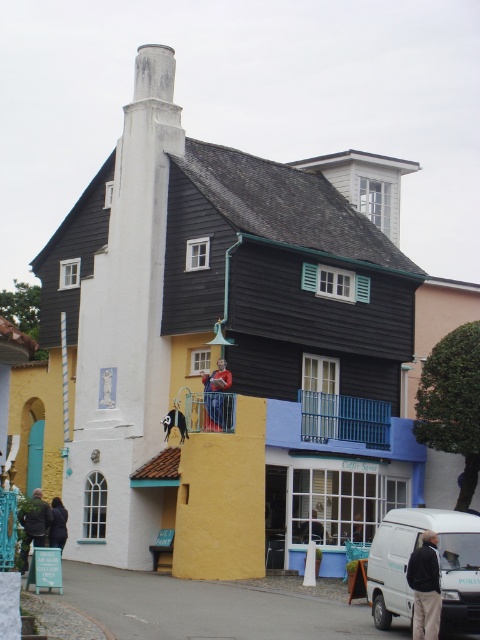
Between blue painted wood balcony at center and dark blue fabric at center, which one is positioned higher?

Positioned higher is blue painted wood balcony at center.

The image size is (480, 640). What do you see at coordinates (210, 412) in the screenshot? I see `blue painted wood balcony at center` at bounding box center [210, 412].

Between point (189, 403) and point (308, 524), which one is positioned behind?

The point (308, 524) is more distant.

At what (x,y) coordinates should I click in order to perform the action: click on blue painted wood balcony at center. Please return your answer as a coordinate pair (x, y). The height and width of the screenshot is (640, 480). Looking at the image, I should click on (210, 412).

Is black leather jacket at lower right below denim pants at center?

Indeed, black leather jacket at lower right is positioned under denim pants at center.

Who is higher up, black leather jacket at lower right or denim pants at center?

Positioned higher is denim pants at center.

Find the location of a particular element. black leather jacket at lower right is located at coordinates (425, 588).

Does denim pants at center come in front of dark green jacket at lower left?

That is False.

Is denim pants at center shorter than dark green jacket at lower left?

No.

The image size is (480, 640). Describe the element at coordinates (216, 396) in the screenshot. I see `denim pants at center` at that location.

Image resolution: width=480 pixels, height=640 pixels. What are the coordinates of `denim pants at center` in the screenshot? It's located at (216, 396).